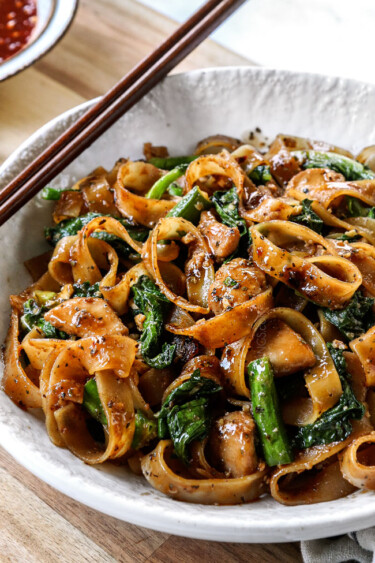
The width and height of the screenshot is (375, 563). Find the location of `light brown wooden tabletop`. light brown wooden tabletop is located at coordinates (94, 26), (92, 534).